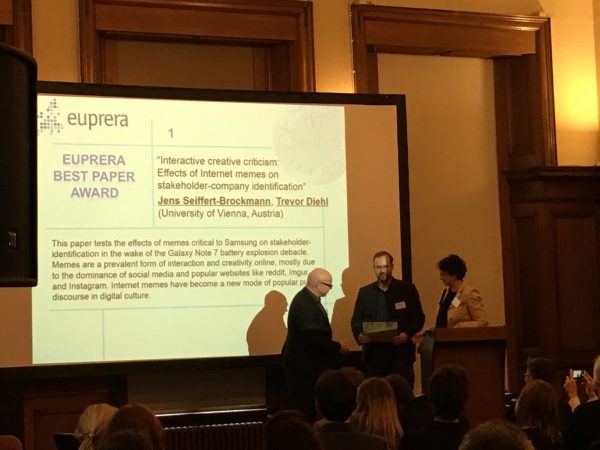
Locate an element on the screen. This screenshot has height=450, width=600. black frame is located at coordinates (399, 104).